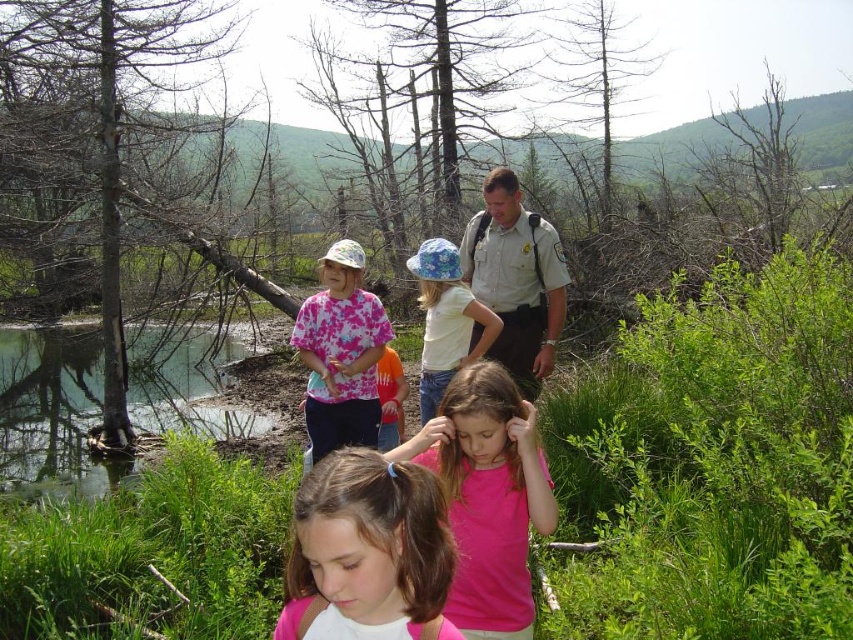
In the scene shown: Can you confirm if khaki uniform at center is positioned above orange cotton shirt at center?

Correct, khaki uniform at center is located above orange cotton shirt at center.

Between khaki uniform at center and orange cotton shirt at center, which one has more height?

Standing taller between the two is khaki uniform at center.

Locate an element on the screen. The image size is (853, 640). khaki uniform at center is located at coordinates (515, 280).

Which of these two, green grassy creek at lower left or orange cotton shirt at center, stands shorter?

With less height is orange cotton shirt at center.

Can you confirm if green grassy creek at lower left is positioned to the left of orange cotton shirt at center?

Yes, green grassy creek at lower left is to the left of orange cotton shirt at center.

Is point (167, 362) farther from camera compared to point (395, 442)?

Yes.

This screenshot has height=640, width=853. Identify the location of green grassy creek at lower left. (51, 413).

Who is lower down, tie-dye fabric shirt at center or orange cotton shirt at center?

orange cotton shirt at center

Describe the element at coordinates (341, 353) in the screenshot. I see `tie-dye fabric shirt at center` at that location.

Image resolution: width=853 pixels, height=640 pixels. In order to click on tie-dye fabric shirt at center in this screenshot , I will do `click(341, 353)`.